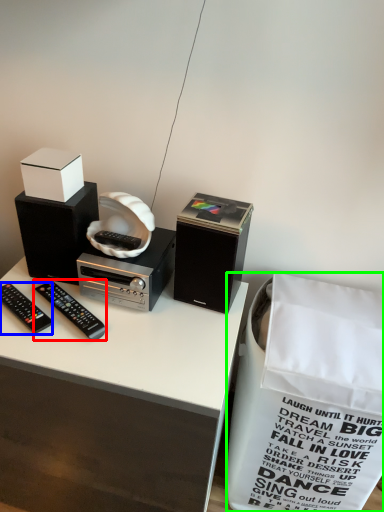
Question: Which object is positioned closest to remote control (highlighted by a red box)? Select from remote control (highlighted by a blue box) and shopping bag (highlighted by a green box).

Choices:
 (A) remote control
 (B) shopping bag

Answer: (A)